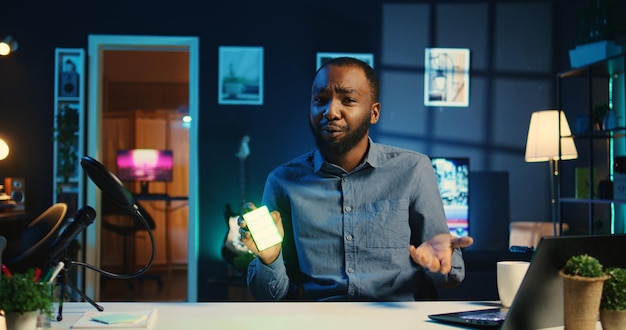
Locate an element on the screen. lamps is located at coordinates (541, 134), (6, 150), (4, 50).